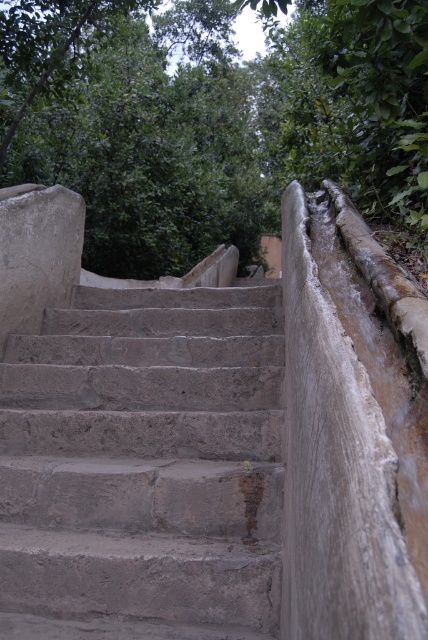
Is gray stone stairs at center positioned at the back of green leafy tree at upper center?

No, gray stone stairs at center is in front of green leafy tree at upper center.

Where is `gray stone stairs at center`? This screenshot has height=640, width=428. gray stone stairs at center is located at coordinates (143, 467).

Image resolution: width=428 pixels, height=640 pixels. In order to click on gray stone stairs at center in this screenshot , I will do `click(143, 467)`.

Identify the location of gray stone stairs at center. (143, 467).